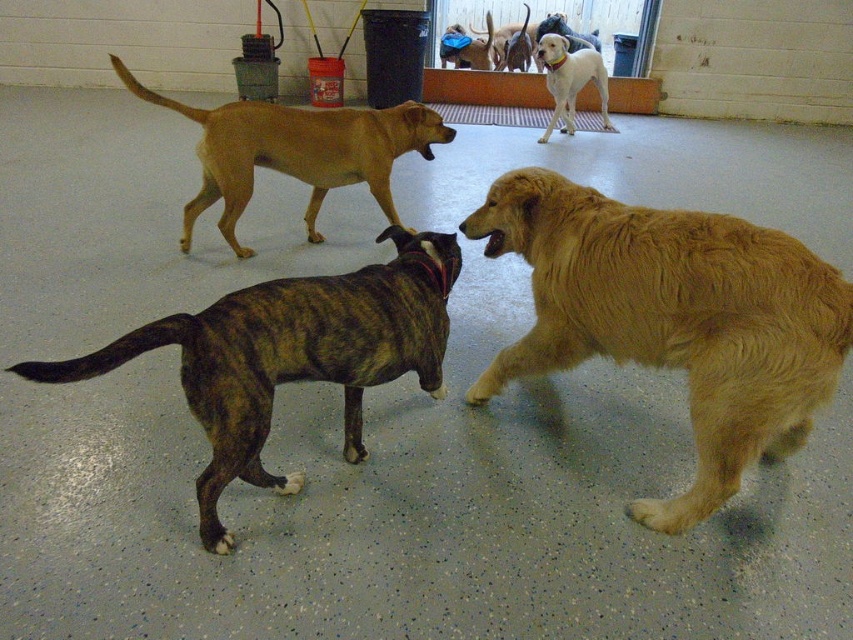
Question: Is golden fur dog at center positioned before golden brown fur at center?

Choices:
 (A) no
 (B) yes

Answer: (B)

Question: Does golden fur dog at center have a smaller size compared to white smooth dog at upper center?

Choices:
 (A) no
 (B) yes

Answer: (B)

Question: Is brindle fur dog at lower left behind golden brown fur at center?

Choices:
 (A) yes
 (B) no

Answer: (B)

Question: Which object is positioned closest to the brindle fur dog at lower left?

Choices:
 (A) golden brown fur at center
 (B) golden fur dog at center
 (C) blue fabric dog at center

Answer: (B)

Question: Which point is farther to the camera?

Choices:
 (A) (631, 220)
 (B) (392, 141)
 (C) (398, 328)
 (D) (489, 44)

Answer: (D)

Question: Which object is positioned closest to the blue fabric dog at center?

Choices:
 (A) golden brown fur at center
 (B) brindle fur dog at lower left

Answer: (A)